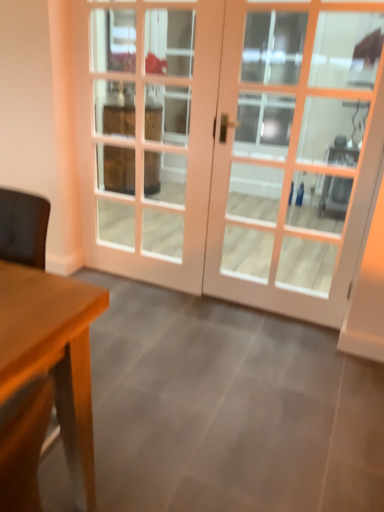
Question: Considering the positions of white wooden door at center and white glass screen door at center in the image, is white wooden door at center bigger or smaller than white glass screen door at center?

Choices:
 (A) big
 (B) small

Answer: (A)

Question: Is white wooden door at center in front of or behind white glass screen door at center in the image?

Choices:
 (A) behind
 (B) front

Answer: (B)

Question: Considering the relative positions of white wooden door at center and white glass screen door at center in the image provided, is white wooden door at center to the left or to the right of white glass screen door at center?

Choices:
 (A) right
 (B) left

Answer: (A)

Question: Based on their sizes in the image, would you say white glass screen door at center is bigger or smaller than white wooden door at center?

Choices:
 (A) small
 (B) big

Answer: (A)

Question: Is point coord(127,45) closer or farther from the camera than point coord(379,142)?

Choices:
 (A) closer
 (B) farther

Answer: (B)

Question: From the image's perspective, is white glass screen door at center positioned above or below white wooden door at center?

Choices:
 (A) above
 (B) below

Answer: (A)

Question: Relative to white wooden door at center, is white glass screen door at center in front or behind?

Choices:
 (A) front
 (B) behind

Answer: (B)